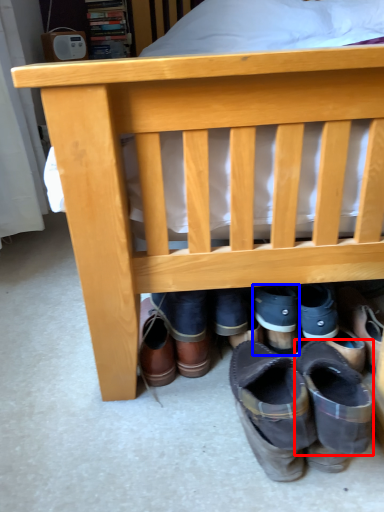
Question: Among these objects, which one is farthest to the camera, shoe (highlighted by a red box) or footwear (highlighted by a blue box)?

Choices:
 (A) shoe
 (B) footwear

Answer: (B)